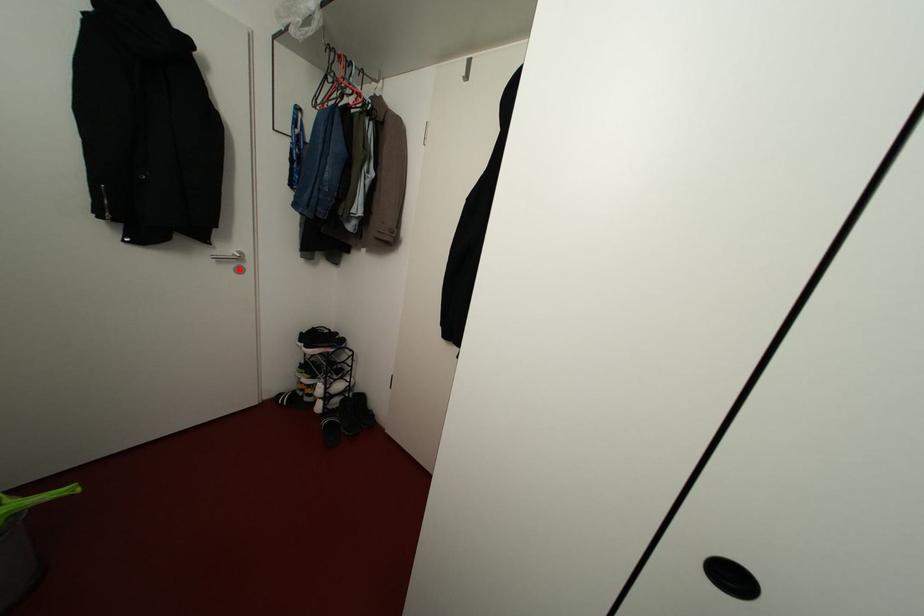
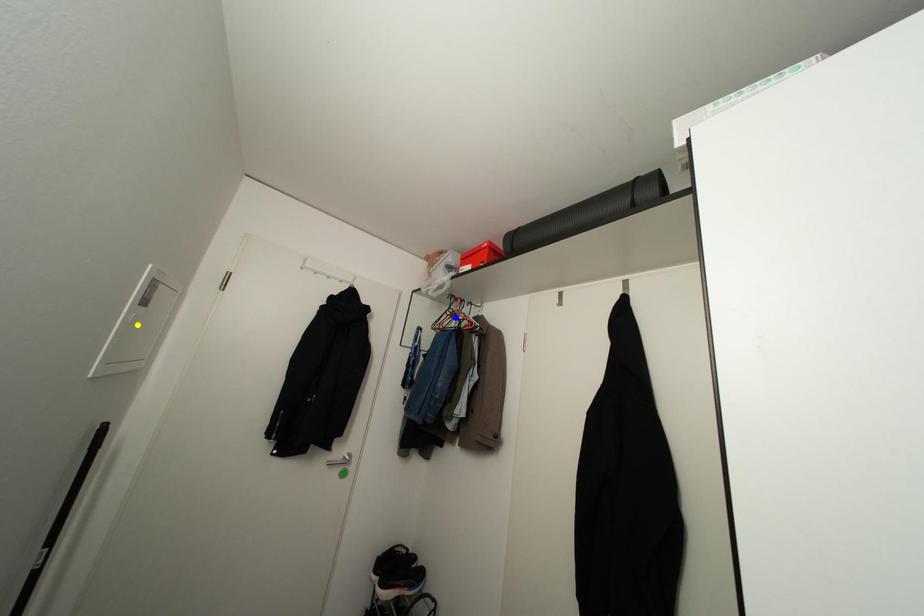
Question: I am providing you with two images of the same scene from different viewpoints. A red point is marked on the first image. You are given multiple points on the second image. Which spot in image 2 lines up with the point in image 1?

Choices:
 (A) green point
 (B) blue point
 (C) yellow point

Answer: (A)